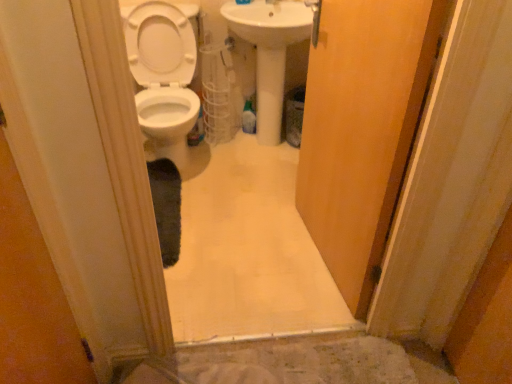
The image size is (512, 384). In order to click on free space that is in between white glossy toilet at left and white glossy sink at center in this screenshot , I will do `click(249, 168)`.